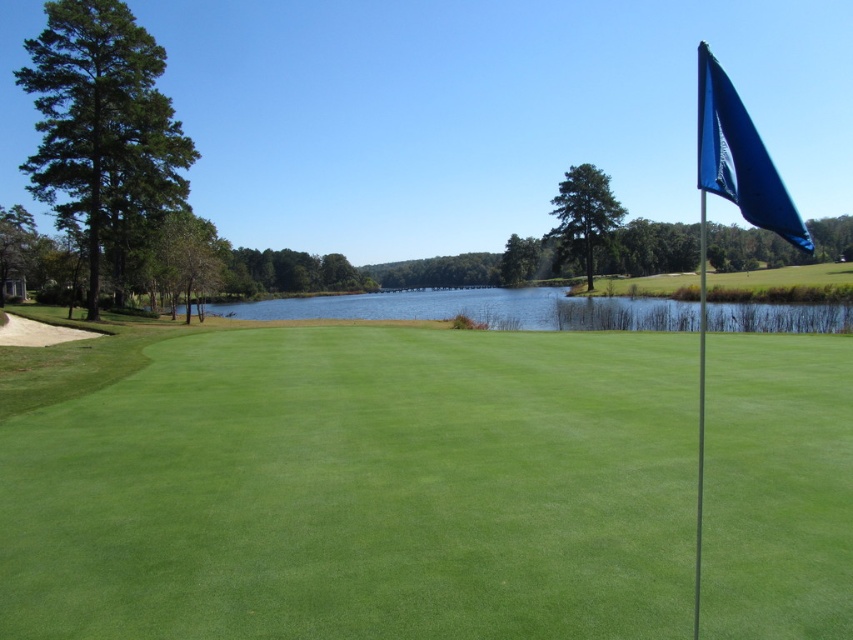
You are a golfer standing at the point marked by the flag on the right side of the frame. You want to hit a ball to the center of the water at the clear blue water at center. Is the point marked by the coordinates point (x=480, y=308) on the path between your current position and the center of the water?

The point marked by the coordinates point (x=480, y=308) is on clear blue water at center, so yes, the point is on the path between your current position at the flag on the right side and the center of the clear blue water at center.

You are a golfer standing on the green putting surface and want to hit the ball to the flag. Which object is closer to you, the clear blue water at center or the blue fabric flag at upper right?

The clear blue water at center is closer to you because it is further to the viewer than the blue fabric flag at upper right.